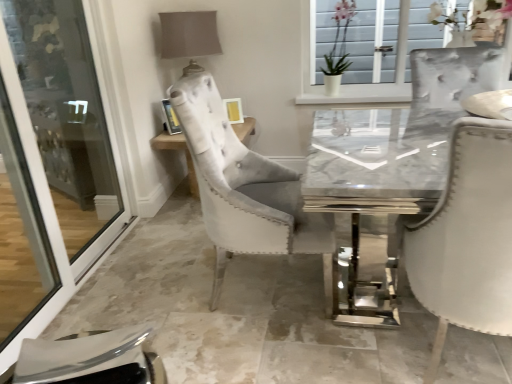
Question: From a real-world perspective, relative to transparent glass screen door at left, is white glossy vase at upper center vertically above or below?

Choices:
 (A) above
 (B) below

Answer: (A)

Question: Is white glossy vase at upper center bigger or smaller than transparent glass screen door at left?

Choices:
 (A) small
 (B) big

Answer: (A)

Question: Estimate the real-world distances between objects in this image. Which object is closer to the transparent glass screen door at left?

Choices:
 (A) white glossy vase at upper center
 (B) metallic silver picture frame at upper center
 (C) marble table at center

Answer: (C)

Question: Estimate the real-world distances between objects in this image. Which object is closer to the marble table at center?

Choices:
 (A) transparent glass screen door at left
 (B) white glossy vase at upper center
 (C) metallic silver picture frame at upper center

Answer: (C)